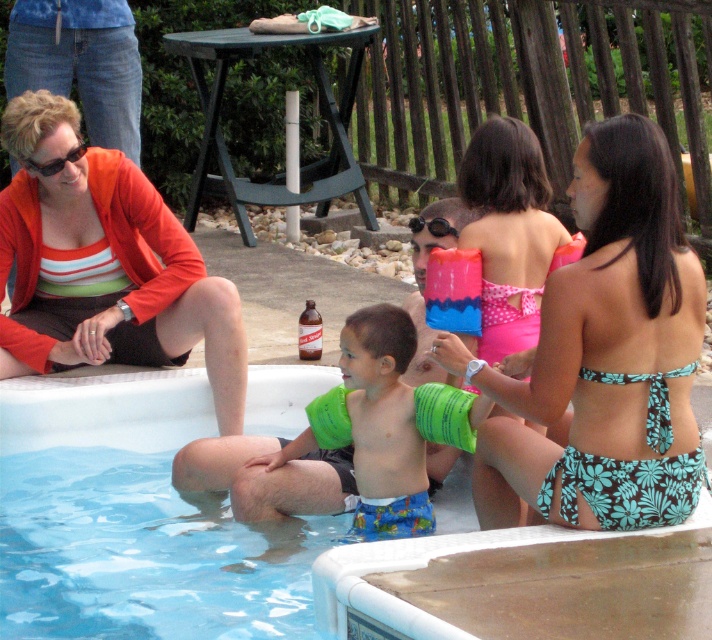
Can you confirm if pink polka dot bikini at upper center is shorter than black rubber goggles at center?

No.

Is pink polka dot bikini at upper center positioned at the back of black rubber goggles at center?

No, it is in front of black rubber goggles at center.

Image resolution: width=712 pixels, height=640 pixels. I want to click on pink polka dot bikini at upper center, so click(x=508, y=230).

From the picture: Which of these two, floral bikini at center or pink polka dot bikini at upper center, stands taller?

Standing taller between the two is floral bikini at center.

Between floral bikini at center and pink polka dot bikini at upper center, which one is positioned lower?

floral bikini at center is lower down.

Between point (518, 426) and point (511, 202), which one is positioned in front?

Point (518, 426) is in front.

Image resolution: width=712 pixels, height=640 pixels. I want to click on floral bikini at center, so click(x=602, y=356).

Does floral bikini at center appear on the right side of matte black sunglasses at upper left?

Correct, you'll find floral bikini at center to the right of matte black sunglasses at upper left.

Does point (590, 328) come behind point (56, 157)?

No.

Between point (627, 388) and point (46, 164), which one is positioned in front?

Point (627, 388)

In order to click on floral bikini at center in this screenshot , I will do [602, 356].